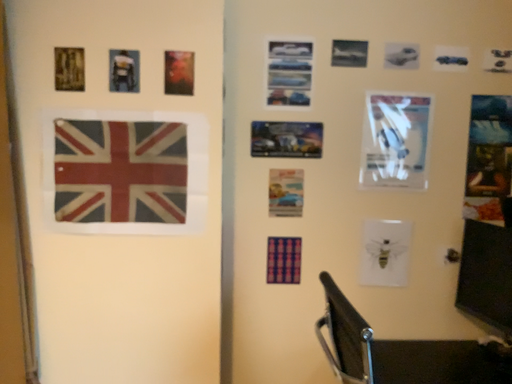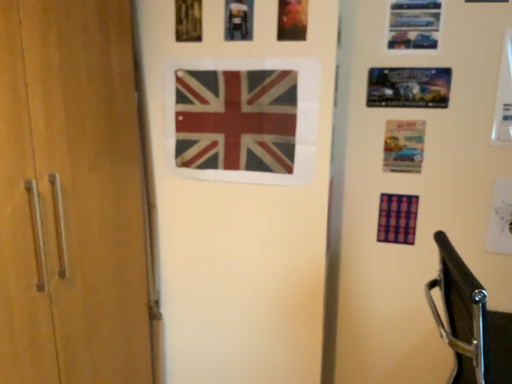
Question: Which way did the camera rotate in the video?

Choices:
 (A) rotated right
 (B) rotated left

Answer: (B)